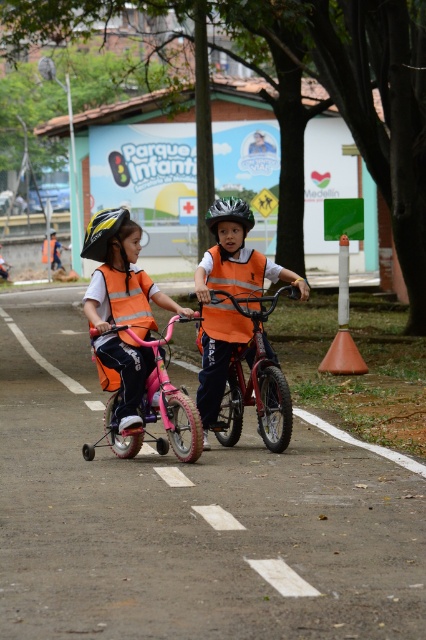
You are a safety inspector checking the visibility of safety gear in the scene. The matte orange vest at center and the metallic red bicycle at center are both in the same area. Which object is smaller in size?

The matte orange vest at center is smaller than the metallic red bicycle at center according to the description.

You are a pedestrian standing at the point marked by the coordinate point [121,308]. You want to cross the road to reach the Childrens Park building. Is there any object between you and the building that you need to be cautious of?

The matte orange vest at center is represented by point [121,308]. The vest is worn by a child riding a pink bicycle with training wheels, so you should be cautious of the pink bicycle with training wheels and the red bicycle without training wheels as they are on the road near your position.

You are a safety inspector checking the visibility of safety gear on the left child. Which item, the orange reflective safety vest at left or the yellow matte bicycle helmet at left, has a smaller width when viewed from the front?

The orange reflective safety vest at left is thinner than the yellow matte bicycle helmet at left, so the orange reflective safety vest at left has a smaller width when viewed from the front.